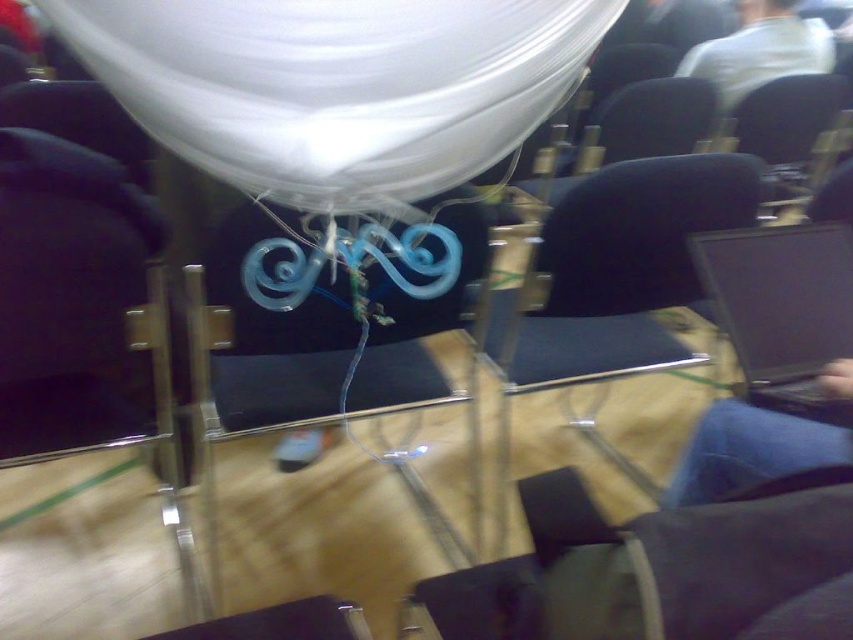
Is black glossy laptop at center taller than black fabric chair at upper right?

No, black glossy laptop at center is not taller than black fabric chair at upper right.

Who is positioned more to the left, black glossy laptop at center or black fabric chair at upper right?

black glossy laptop at center is more to the left.

Is point (804, 240) behind point (755, 100)?

No, it is in front of (755, 100).

At what (x,y) coordinates should I click in order to perform the action: click on black glossy laptop at center. Please return your answer as a coordinate pair (x, y). The height and width of the screenshot is (640, 853). Looking at the image, I should click on (780, 305).

Does white cotton shirt at upper right have a smaller size compared to black fabric chair at upper right?

No.

Locate an element on the screen. Image resolution: width=853 pixels, height=640 pixels. white cotton shirt at upper right is located at coordinates (759, 51).

Does transparent plastic armchair at center have a lesser height compared to white cotton shirt at upper right?

In fact, transparent plastic armchair at center may be taller than white cotton shirt at upper right.

Is transparent plastic armchair at center above white cotton shirt at upper right?

No, transparent plastic armchair at center is not above white cotton shirt at upper right.

Is point (445, 401) farther from camera compared to point (775, 28)?

That is False.

Where is `transparent plastic armchair at center`? Image resolution: width=853 pixels, height=640 pixels. transparent plastic armchair at center is located at coordinates (329, 333).